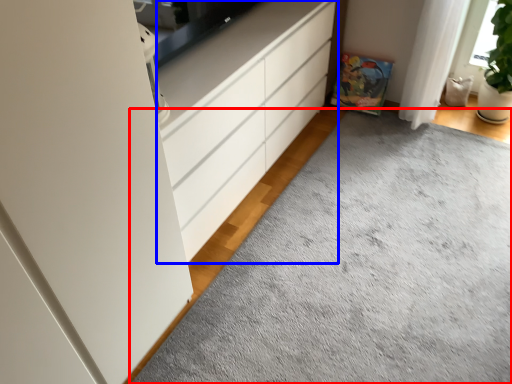
Question: Which point is further to the camera, plain (highlighted by a red box) or chest of drawers (highlighted by a blue box)?

Choices:
 (A) plain
 (B) chest of drawers

Answer: (B)